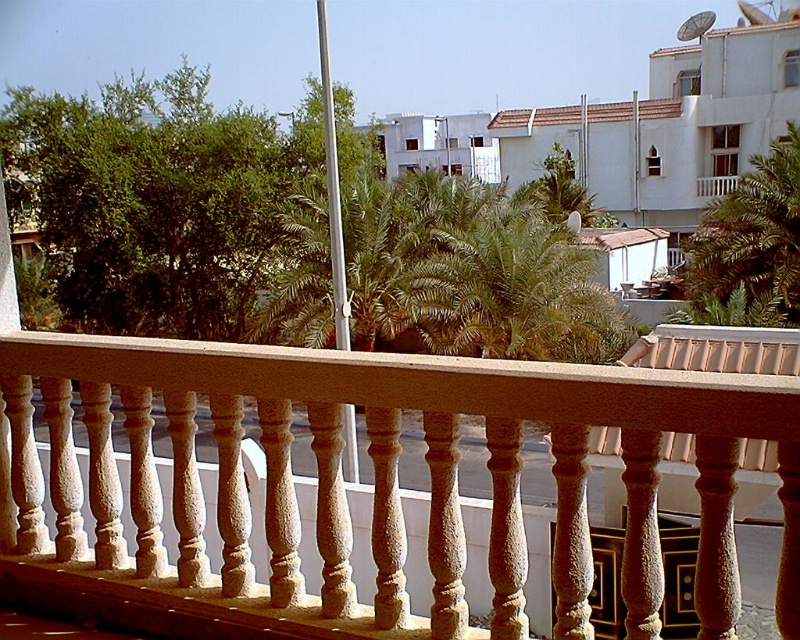
How far apart are smooth beige balustrade at center and white textured balcony at upper right?

smooth beige balustrade at center is 44.33 meters from white textured balcony at upper right.

Is point (168, 561) positioned behind point (720, 193)?

No, it is not.

Where is `smooth beige balustrade at center`? This screenshot has width=800, height=640. smooth beige balustrade at center is located at coordinates (380, 476).

Who is more distant from viewer, (766, 314) or (704, 179)?

The point (704, 179) is behind.

Where is `green leafy palm tree at upper right`? green leafy palm tree at upper right is located at coordinates (750, 241).

What do you see at coordinates (750, 241) in the screenshot? I see `green leafy palm tree at upper right` at bounding box center [750, 241].

Where is `green leafy palm tree at upper right`? green leafy palm tree at upper right is located at coordinates (750, 241).

Is point (252, 577) farther from viewer compared to point (548, 349)?

No, it is in front of (548, 349).

Is smooth beige balustrade at center wider than green leafy palm tree at center?

Yes, smooth beige balustrade at center is wider than green leafy palm tree at center.

Between point (214, 566) and point (468, 275), which one is positioned behind?

Point (468, 275)

Identify the location of smooth beige balustrade at center. (380, 476).